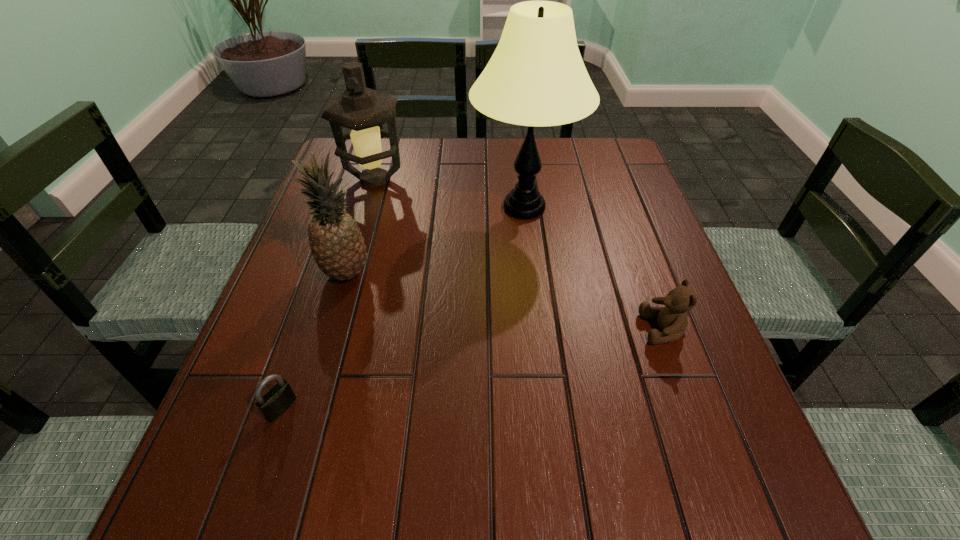
At what (x,y) coordinates should I click in order to perform the action: click on free space that satisfies the following two spatial constraints: 1. on the back side of the third nearest object; 2. on the left side of the tallest object. Please return your answer as a coordinate pair (x, y). Looking at the image, I should click on (366, 207).

This screenshot has height=540, width=960. In order to click on free space that satisfies the following two spatial constraints: 1. on the back side of the pineapple; 2. on the right side of the oil lamp in this screenshot , I will do `click(373, 180)`.